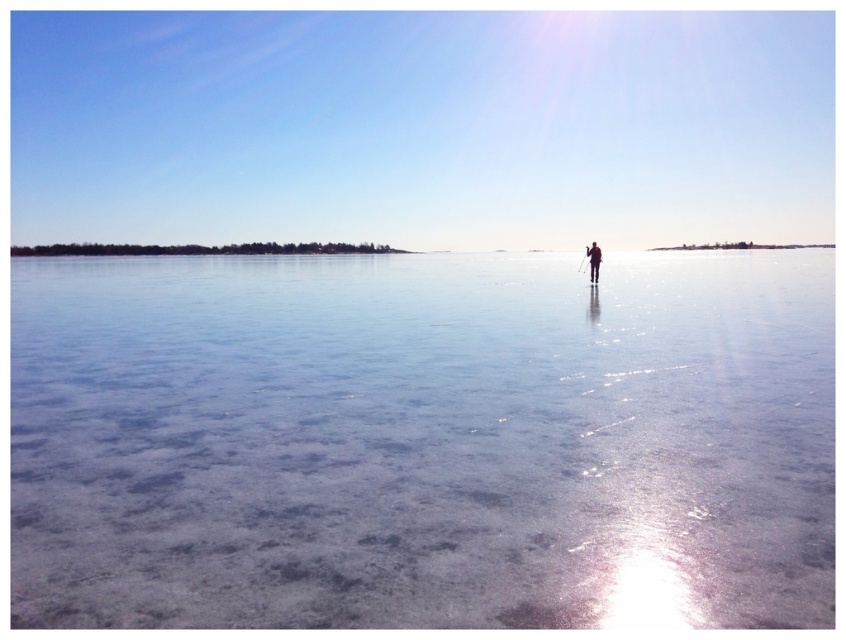
Is transparent ice at center wider than silhouette figure at center?

Correct, the width of transparent ice at center exceeds that of silhouette figure at center.

Can you confirm if transparent ice at center is positioned above silhouette figure at center?

Yes.

Locate an element on the screen. This screenshot has width=846, height=640. transparent ice at center is located at coordinates (423, 440).